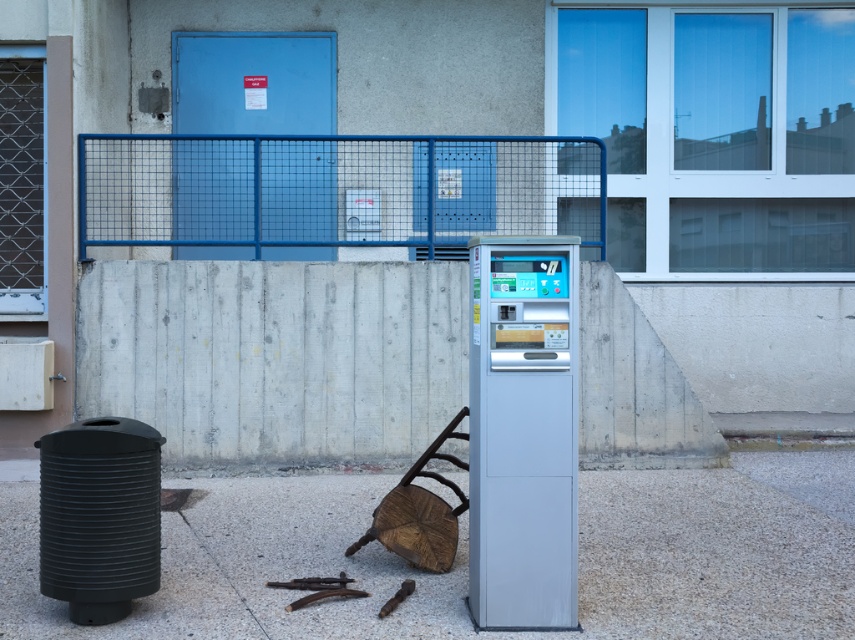
Is gray concrete pavement at center taller than blue wire mesh fence at upper center?

Result: In fact, gray concrete pavement at center may be shorter than blue wire mesh fence at upper center.

Does gray concrete pavement at center have a smaller size compared to blue wire mesh fence at upper center?

Yes, gray concrete pavement at center is smaller than blue wire mesh fence at upper center.

Describe the element at coordinates (718, 548) in the screenshot. I see `gray concrete pavement at center` at that location.

This screenshot has width=855, height=640. I want to click on gray concrete pavement at center, so click(x=718, y=548).

Is satin silver machine at center wider than black ribbed trash can at lower left?

No.

You are a GUI agent. You are given a task and a screenshot of the screen. Output one action in this format:
    pyautogui.click(x=<x>, y=<y>)
    Task: Click on the satin silver machine at center
    
    Given the screenshot: What is the action you would take?
    pyautogui.click(x=522, y=433)

Is point (529, 397) positioned before point (52, 573)?

Yes, it is.

This screenshot has height=640, width=855. I want to click on satin silver machine at center, so click(522, 433).

Can you confirm if gray concrete pavement at center is positioned to the left of satin silver machine at center?

In fact, gray concrete pavement at center is to the right of satin silver machine at center.

Does point (729, 513) lie behind point (485, 348)?

Yes, point (729, 513) is behind point (485, 348).

Identify the location of gray concrete pavement at center. (718, 548).